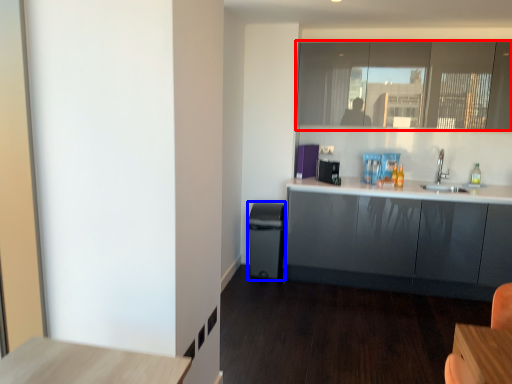
Question: Which point is further to the camera, window (highlighted by a red box) or dish washer (highlighted by a blue box)?

Choices:
 (A) window
 (B) dish washer

Answer: (B)